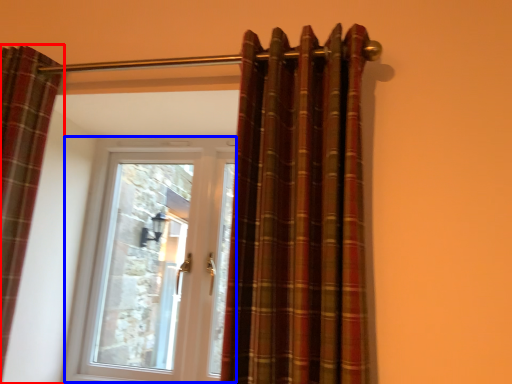
Question: Which of the following is the farthest to the observer, curtain (highlighted by a red box) or door (highlighted by a blue box)?

Choices:
 (A) curtain
 (B) door

Answer: (B)